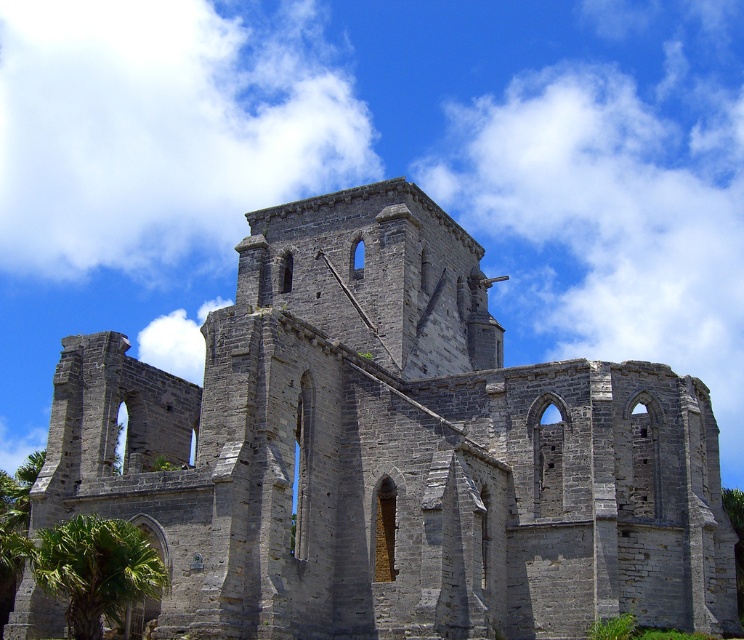
What do you see at coordinates (391, 451) in the screenshot? This screenshot has width=744, height=640. I see `gray stone ruins at center` at bounding box center [391, 451].

Who is taller, gray stone ruins at center or green leafy palm tree at lower left?

gray stone ruins at center

Which is behind, point (420, 420) or point (89, 600)?

Positioned behind is point (420, 420).

I want to click on gray stone ruins at center, so click(x=391, y=451).